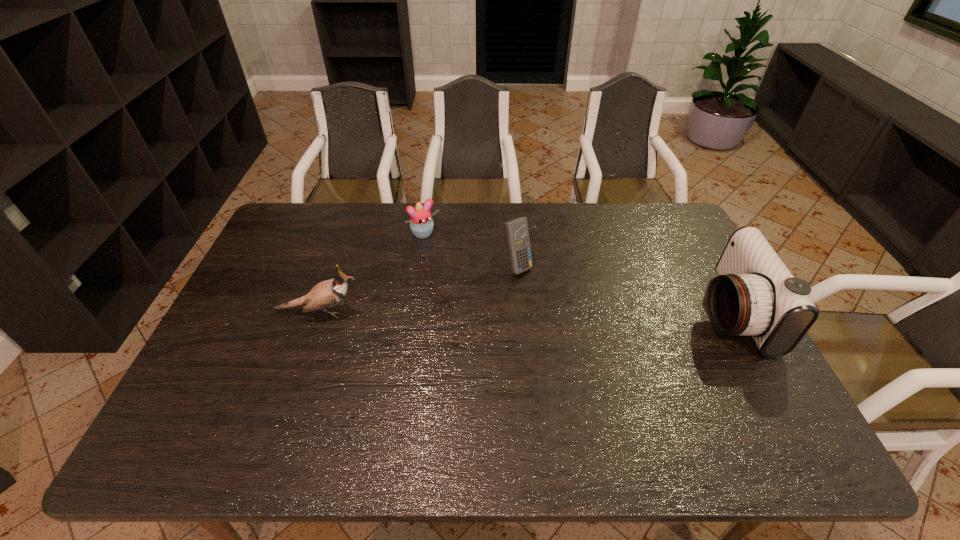
At what (x,y) coordinates should I click in order to perform the action: click on free space at the left edge. Please return your answer as a coordinate pair (x, y). This screenshot has width=960, height=540. Looking at the image, I should click on (232, 328).

Where is `free space at the right edge of the desktop`? The height and width of the screenshot is (540, 960). free space at the right edge of the desktop is located at coordinates (660, 271).

You are a GUI agent. You are given a task and a screenshot of the screen. Output one action in this format:
    pyautogui.click(x=<x>, y=<y>)
    Task: Click on the free location at the near left corner of the desktop
    The image size is (960, 540).
    Given the screenshot: What is the action you would take?
    [x=204, y=413]

Image resolution: width=960 pixels, height=540 pixels. In the image, there is a desktop. Identify the location of free space at the far right corner. (677, 217).

The height and width of the screenshot is (540, 960). In the image, there is a desktop. Identify the location of vacant space at the near right corner. (745, 410).

Find the location of a particular element. The height and width of the screenshot is (540, 960). free space between the farthest object and the bird is located at coordinates (x=372, y=273).

At what (x,y) coordinates should I click in order to perform the action: click on vacant area that lies between the leftmost object and the rightmost object. Please return your answer as a coordinate pair (x, y). The width and height of the screenshot is (960, 540). Looking at the image, I should click on [x=524, y=312].

Where is `vacant region between the cupcake and the bird`? Image resolution: width=960 pixels, height=540 pixels. vacant region between the cupcake and the bird is located at coordinates (372, 273).

What are the coordinates of `free space between the second object from left to right and the calculator` in the screenshot? It's located at (470, 249).

Where is `vacant area between the second object from right to left and the second object from left to right`? This screenshot has width=960, height=540. vacant area between the second object from right to left and the second object from left to right is located at coordinates (470, 249).